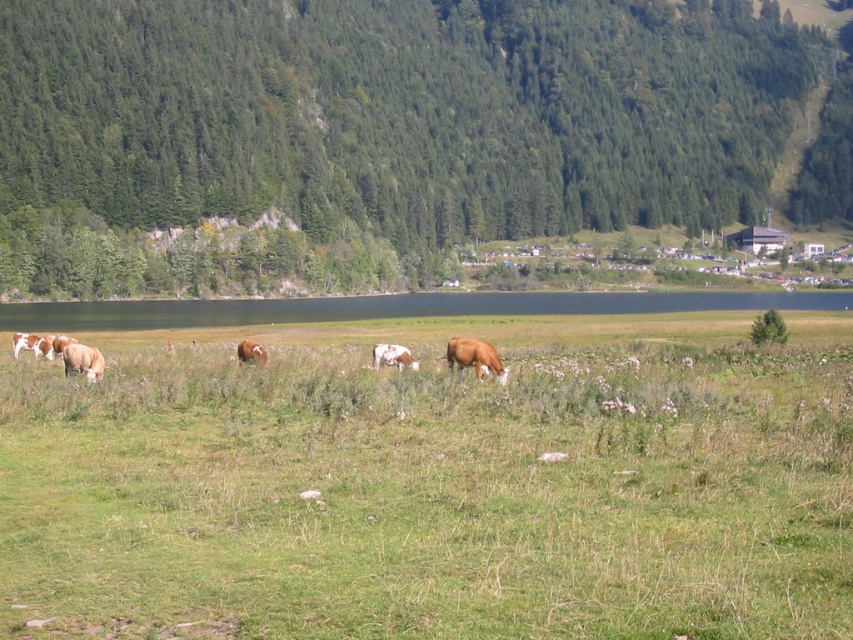
Does green forested hillside at upper center appear on the left side of brown speckled cow at lower left?

Incorrect, green forested hillside at upper center is not on the left side of brown speckled cow at lower left.

Is green forested hillside at upper center bigger than brown speckled cow at lower left?

Yes, green forested hillside at upper center is bigger than brown speckled cow at lower left.

Image resolution: width=853 pixels, height=640 pixels. What are the coordinates of `green forested hillside at upper center` in the screenshot? It's located at (378, 125).

Does green grassy field at center have a lesser height compared to brown smooth cow at center?

Incorrect, green grassy field at center's height does not fall short of brown smooth cow at center's.

Consider the image. Can you confirm if green grassy field at center is taller than brown smooth cow at center?

Yes.

Identify the location of green grassy field at center. This screenshot has height=640, width=853. (434, 484).

Does green forested hillside at upper center have a smaller size compared to brown furry cow at center?

Actually, green forested hillside at upper center might be larger than brown furry cow at center.

Can you confirm if green forested hillside at upper center is bigger than brown furry cow at center?

Correct, green forested hillside at upper center is larger in size than brown furry cow at center.

The height and width of the screenshot is (640, 853). Find the location of `green forested hillside at upper center`. green forested hillside at upper center is located at coordinates (378, 125).

You are a GUI agent. You are given a task and a screenshot of the screen. Output one action in this format:
    pyautogui.click(x=<x>, y=<y>)
    Task: Click on the green forested hillside at upper center
    The height and width of the screenshot is (640, 853).
    Given the screenshot: What is the action you would take?
    pyautogui.click(x=378, y=125)